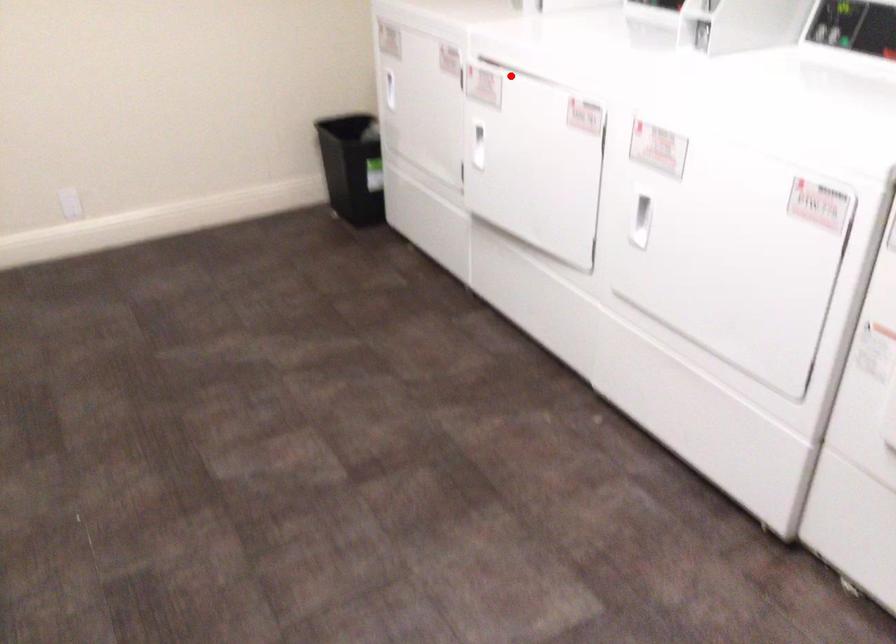
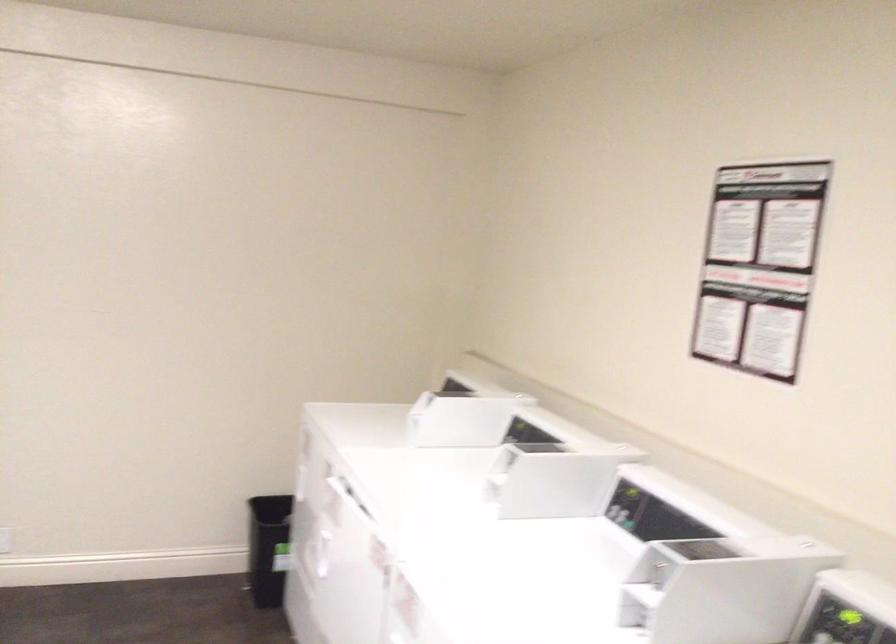
Locate, in the second image, the point that corresponds to the highlighted location in the first image.

(348, 494)